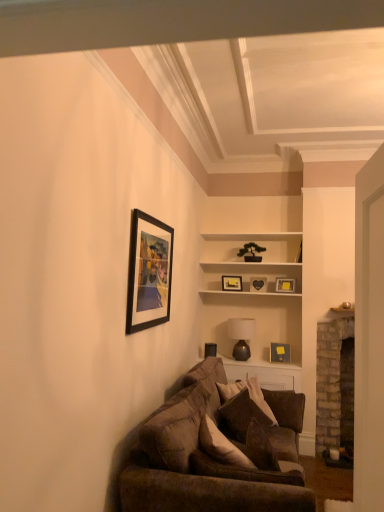
Question: From the image's perspective, would you say matte black picture frame at upper center, which appears as the 2th picture frame when viewed from the right, is positioned over black matte picture frame at upper left, arranged as the first picture frame when viewed from the front?

Choices:
 (A) no
 (B) yes

Answer: (A)

Question: Would you consider matte black picture frame at upper center, arranged as the 4th picture frame when viewed from the back, to be distant from black matte picture frame at upper left, the 1th picture frame from the left?

Choices:
 (A) no
 (B) yes

Answer: (B)

Question: Is matte black picture frame at upper center, the 3th picture frame positioned from the front, beside black matte picture frame at upper left, the 1th picture frame from the left?

Choices:
 (A) yes
 (B) no

Answer: (B)

Question: Is matte black picture frame at upper center, which appears as the 2th picture frame when viewed from the right, facing away from black matte picture frame at upper left, the 1th picture frame from the left?

Choices:
 (A) no
 (B) yes

Answer: (A)

Question: Does matte black picture frame at upper center, arranged as the 4th picture frame when viewed from the back, appear on the right side of black matte picture frame at upper left, the 1th picture frame from the left?

Choices:
 (A) yes
 (B) no

Answer: (A)

Question: Is brown velvety pillow at center bigger or smaller than white wood shelf at upper center?

Choices:
 (A) big
 (B) small

Answer: (B)

Question: Considering the positions of brown velvety pillow at center and white wood shelf at upper center in the image, is brown velvety pillow at center taller or shorter than white wood shelf at upper center?

Choices:
 (A) tall
 (B) short

Answer: (B)

Question: Looking at their shapes, would you say brown velvety pillow at center is wider or thinner than white wood shelf at upper center?

Choices:
 (A) wide
 (B) thin

Answer: (B)

Question: Is brown velvety pillow at center to the left or to the right of white wood shelf at upper center in the image?

Choices:
 (A) right
 (B) left

Answer: (B)

Question: From a real-world perspective, is matte gray picture frame at upper center, the sixth picture frame positioned from the front, above or below matte yellow picture frame at upper right, placed as the second picture frame when sorted from front to back?

Choices:
 (A) below
 (B) above

Answer: (B)

Question: Considering the positions of matte gray picture frame at upper center, the sixth picture frame positioned from the front, and matte yellow picture frame at upper right, the fourth picture frame when ordered from top to bottom, in the image, is matte gray picture frame at upper center, the sixth picture frame positioned from the front, taller or shorter than matte yellow picture frame at upper right, the fourth picture frame when ordered from top to bottom,?

Choices:
 (A) tall
 (B) short

Answer: (A)

Question: Is matte gray picture frame at upper center, the third picture frame from the left, bigger or smaller than matte yellow picture frame at upper right, placed as the 5th picture frame when sorted from back to front?

Choices:
 (A) big
 (B) small

Answer: (B)

Question: Is matte gray picture frame at upper center, which is the 3th picture frame from top to bottom, wider or thinner than matte yellow picture frame at upper right, marked as the 1th picture frame in a right-to-left arrangement?

Choices:
 (A) thin
 (B) wide

Answer: (A)

Question: From the image's perspective, relative to brick fireplace at right, is matte black picture frame at upper left, the 5th picture frame positioned from the right, above or below?

Choices:
 (A) below
 (B) above

Answer: (B)

Question: Looking at their shapes, would you say matte black picture frame at upper left, marked as the 4th picture frame in a front-to-back arrangement, is wider or thinner than brick fireplace at right?

Choices:
 (A) wide
 (B) thin

Answer: (B)